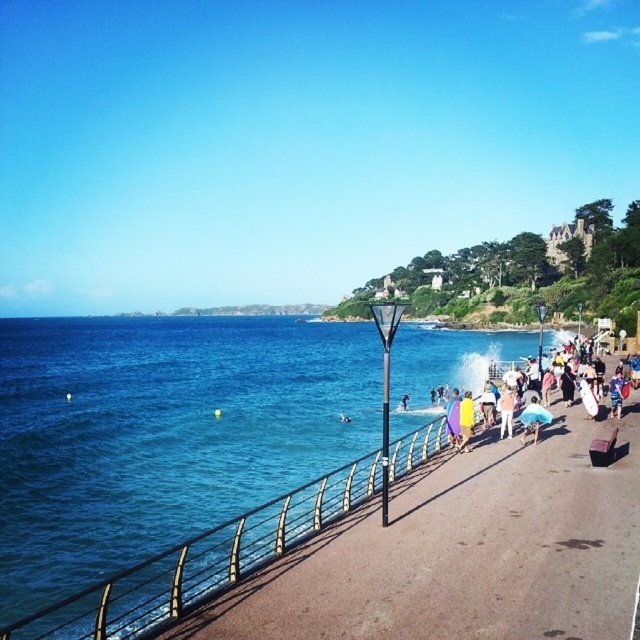
How much distance is there between blue water at lower left and purple fabric at center?

A distance of 85.87 meters exists between blue water at lower left and purple fabric at center.

Is blue water at lower left bigger than purple fabric at center?

Yes.

Describe the element at coordinates (163, 433) in the screenshot. I see `blue water at lower left` at that location.

I want to click on blue water at lower left, so click(x=163, y=433).

The height and width of the screenshot is (640, 640). Describe the element at coordinates (465, 420) in the screenshot. I see `yellow fabric umbrella at center` at that location.

Who is shorter, yellow fabric umbrella at center or pink fabric dress at center?

With less height is pink fabric dress at center.

This screenshot has width=640, height=640. Identify the location of yellow fabric umbrella at center. (465, 420).

Is yellow fabric umbrella at center above purple fabric at center?

Yes, yellow fabric umbrella at center is above purple fabric at center.

Does yellow fabric umbrella at center have a smaller size compared to purple fabric at center?

Yes.

Who is more forward, (465, 420) or (449, 397)?

Point (465, 420)

Locate an element on the screen. yellow fabric umbrella at center is located at coordinates (465, 420).